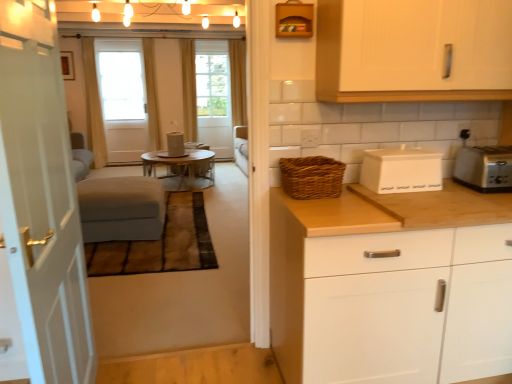
Question: Is the surface of yellow fabric curtain at center, placed as the third curtain when sorted from left to right, in direct contact with velvet grey ottoman at center?

Choices:
 (A) yes
 (B) no

Answer: (B)

Question: Does yellow fabric curtain at center, which is the 2th curtain from right to left, lie in front of velvet grey ottoman at center?

Choices:
 (A) yes
 (B) no

Answer: (B)

Question: Can you confirm if yellow fabric curtain at center, placed as the third curtain when sorted from left to right, is wider than velvet grey ottoman at center?

Choices:
 (A) no
 (B) yes

Answer: (A)

Question: Would you say yellow fabric curtain at center, placed as the third curtain when sorted from left to right, contains velvet grey ottoman at center?

Choices:
 (A) yes
 (B) no

Answer: (B)

Question: Considering the relative sizes of yellow fabric curtain at center, placed as the third curtain when sorted from left to right, and velvet grey ottoman at center in the image provided, is yellow fabric curtain at center, placed as the third curtain when sorted from left to right, thinner than velvet grey ottoman at center?

Choices:
 (A) no
 (B) yes

Answer: (B)

Question: Is yellow fabric curtain at center, placed as the third curtain when sorted from left to right, positioned with its back to velvet grey ottoman at center?

Choices:
 (A) no
 (B) yes

Answer: (A)

Question: Considering the relative sizes of beige fabric curtain at center, acting as the 3th curtain starting from the right, and yellow fabric curtain at upper center, the 4th curtain in the left-to-right sequence, in the image provided, is beige fabric curtain at center, acting as the 3th curtain starting from the right, taller than yellow fabric curtain at upper center, the 4th curtain in the left-to-right sequence,?

Choices:
 (A) yes
 (B) no

Answer: (A)

Question: Is beige fabric curtain at center, arranged as the second curtain when viewed from the left, not close to yellow fabric curtain at upper center, the 4th curtain in the left-to-right sequence?

Choices:
 (A) yes
 (B) no

Answer: (A)

Question: From the image's perspective, is beige fabric curtain at center, acting as the 3th curtain starting from the right, beneath yellow fabric curtain at upper center, which is the first curtain from right to left?

Choices:
 (A) no
 (B) yes

Answer: (B)

Question: From a real-world perspective, is beige fabric curtain at center, arranged as the second curtain when viewed from the left, located higher than yellow fabric curtain at upper center, the 4th curtain in the left-to-right sequence?

Choices:
 (A) yes
 (B) no

Answer: (B)

Question: Is beige fabric curtain at center, acting as the 3th curtain starting from the right, facing towards yellow fabric curtain at upper center, the 4th curtain in the left-to-right sequence?

Choices:
 (A) yes
 (B) no

Answer: (B)

Question: Does beige fabric curtain at center, acting as the 3th curtain starting from the right, have a larger size compared to yellow fabric curtain at upper center, which is the first curtain from right to left?

Choices:
 (A) yes
 (B) no

Answer: (A)

Question: Considering the relative sizes of white matte cabinet at right, the first cabinetry in the bottom-to-top sequence, and white wood cabinet at upper right, arranged as the first cabinetry when viewed from the top, in the image provided, is white matte cabinet at right, the first cabinetry in the bottom-to-top sequence, thinner than white wood cabinet at upper right, arranged as the first cabinetry when viewed from the top,?

Choices:
 (A) yes
 (B) no

Answer: (B)